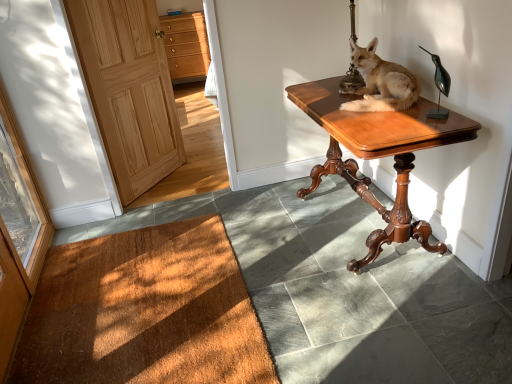
I want to click on free spot to the right of brown textured mat at lower left, so click(x=339, y=286).